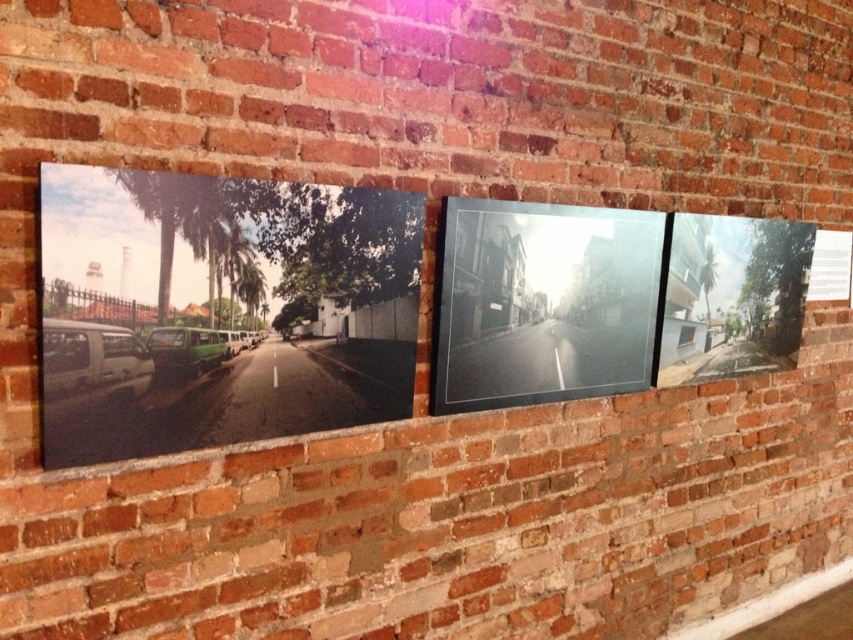
Question: Where is matte canvas print at left located in relation to transparent glass picture frame at center in the image?

Choices:
 (A) below
 (B) above

Answer: (A)

Question: Which point is farther from the camera taking this photo?

Choices:
 (A) (486, 352)
 (B) (343, 355)

Answer: (A)

Question: Does matte canvas print at left come in front of transparent glass picture frame at center?

Choices:
 (A) no
 (B) yes

Answer: (B)

Question: Which point appears closest to the camera in this image?

Choices:
 (A) (84, 348)
 (B) (602, 339)

Answer: (A)

Question: Can you confirm if matte canvas print at left is positioned to the right of transparent glass picture frame at center?

Choices:
 (A) no
 (B) yes

Answer: (A)